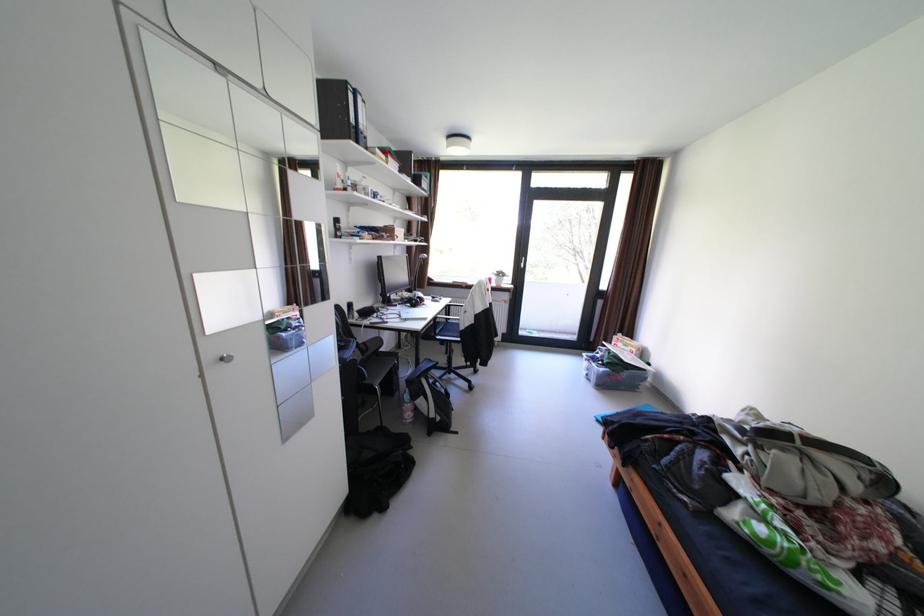
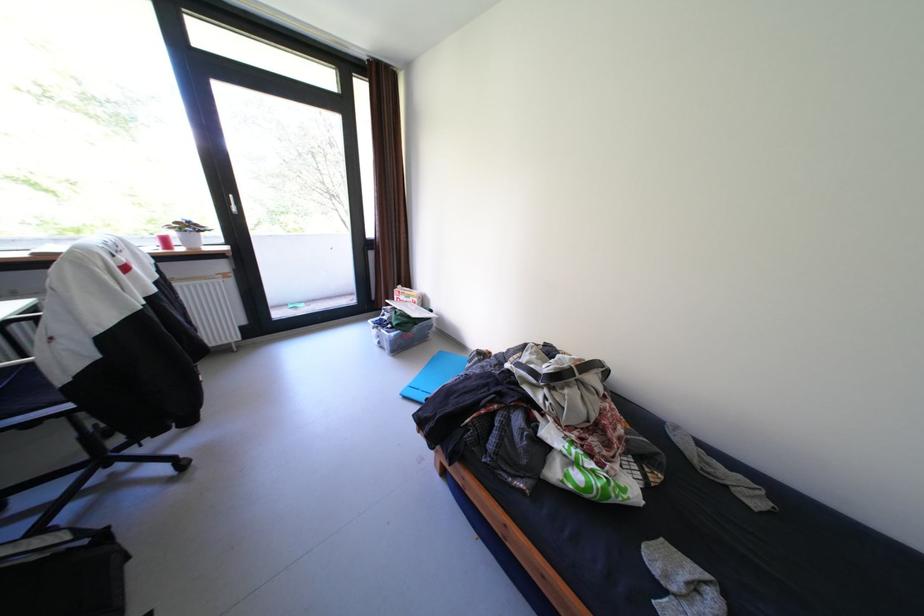
The images are taken continuously from a first-person perspective. In which direction is your viewpoint rotating?

The camera rotated toward right-down.